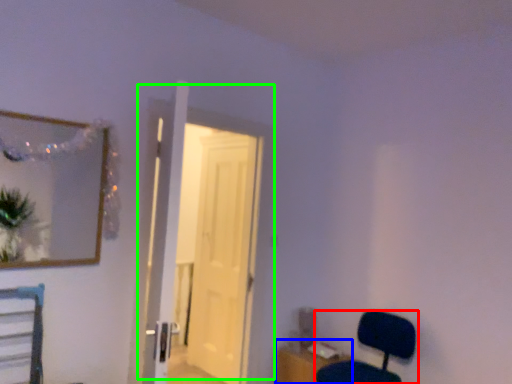
Question: Which is nearer to the chair (highlighted by a red box)? table (highlighted by a blue box) or door (highlighted by a green box).

Choices:
 (A) table
 (B) door

Answer: (A)